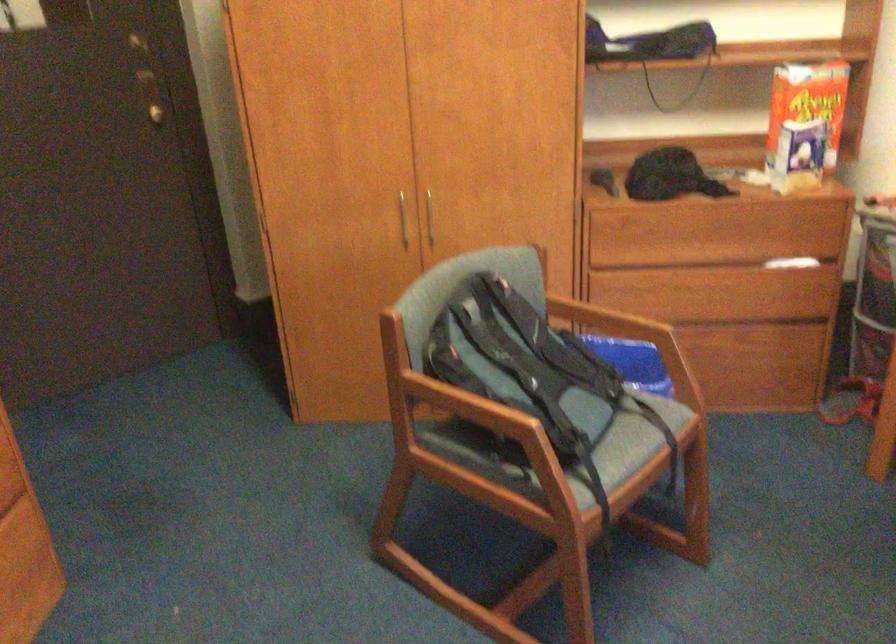
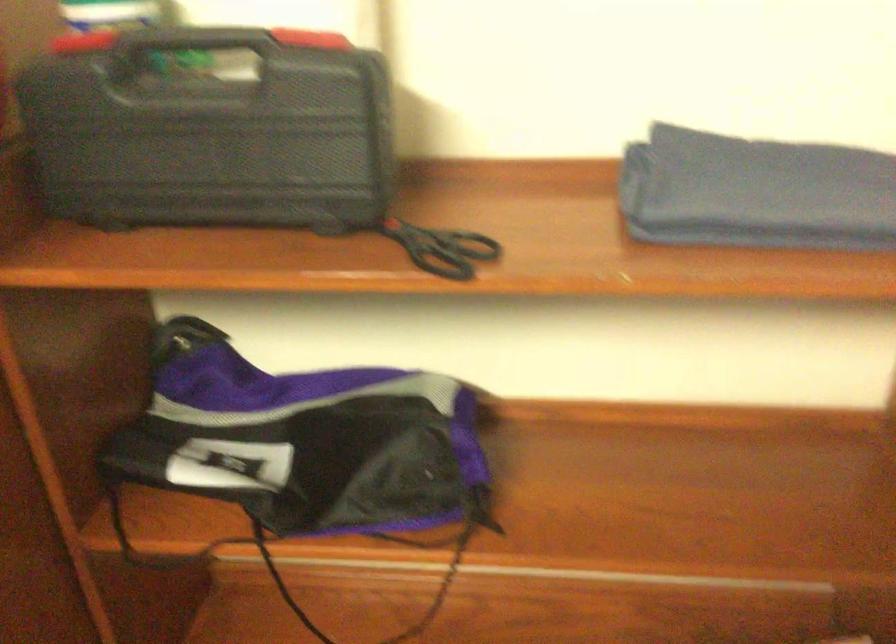
The images are taken continuously from a first-person perspective. In which direction are you moving?

The movement direction of the cameraman is right, forward.